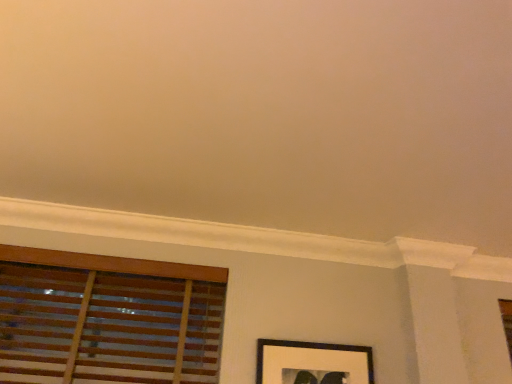
What do you see at coordinates (266, 113) in the screenshot? The height and width of the screenshot is (384, 512). I see `matte white wall at upper center` at bounding box center [266, 113].

This screenshot has width=512, height=384. I want to click on matte white wall at upper center, so click(x=266, y=113).

Where is `matte white wall at upper center`? This screenshot has width=512, height=384. matte white wall at upper center is located at coordinates (266, 113).